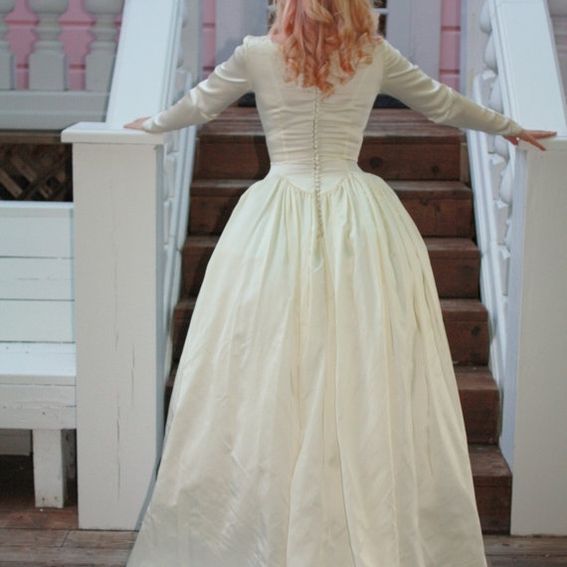
Locate an element on the screen. door is located at coordinates (382, 10).